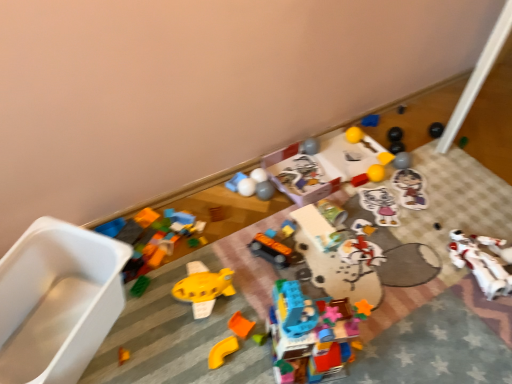
Where is `free space that is to the left of white matte ball at center, which ranks as the twelfth toy in right-to-left order`? The height and width of the screenshot is (384, 512). free space that is to the left of white matte ball at center, which ranks as the twelfth toy in right-to-left order is located at coordinates [x=210, y=194].